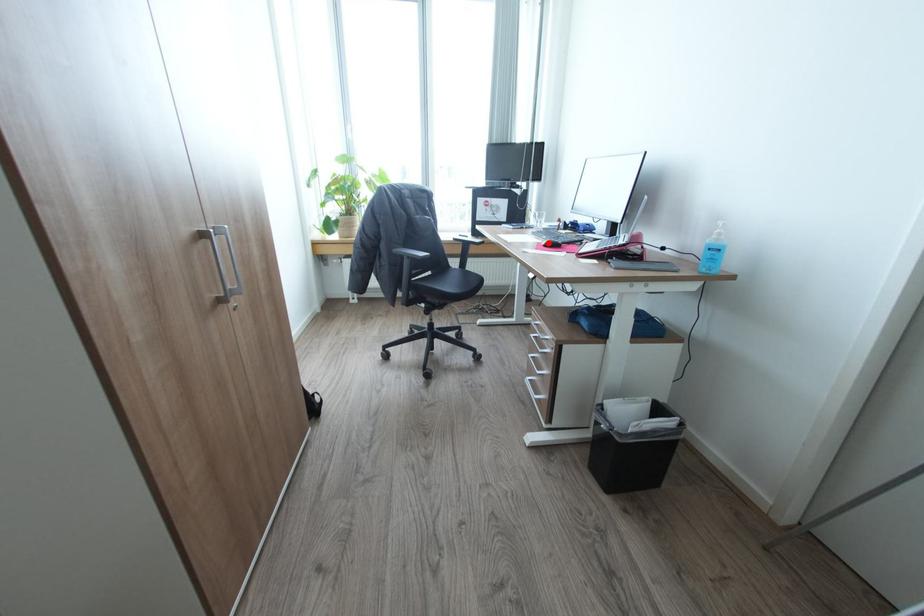
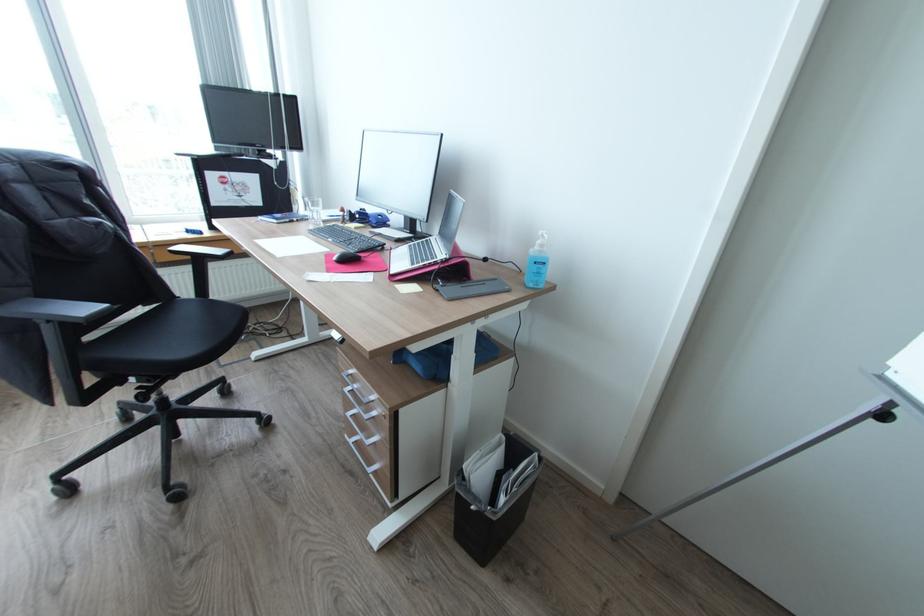
In the second image, find the point that corresponds to the highlighted location in the first image.

(339, 257)